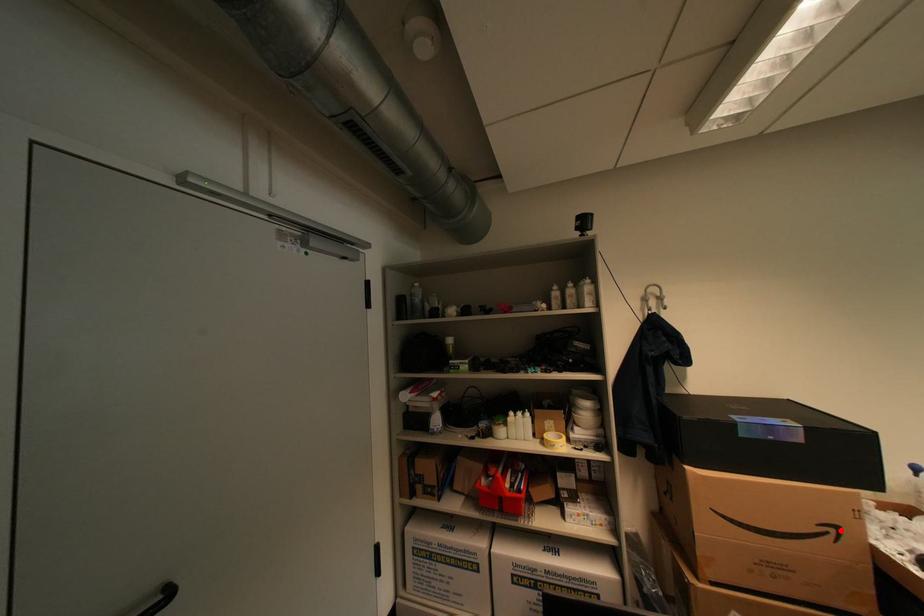
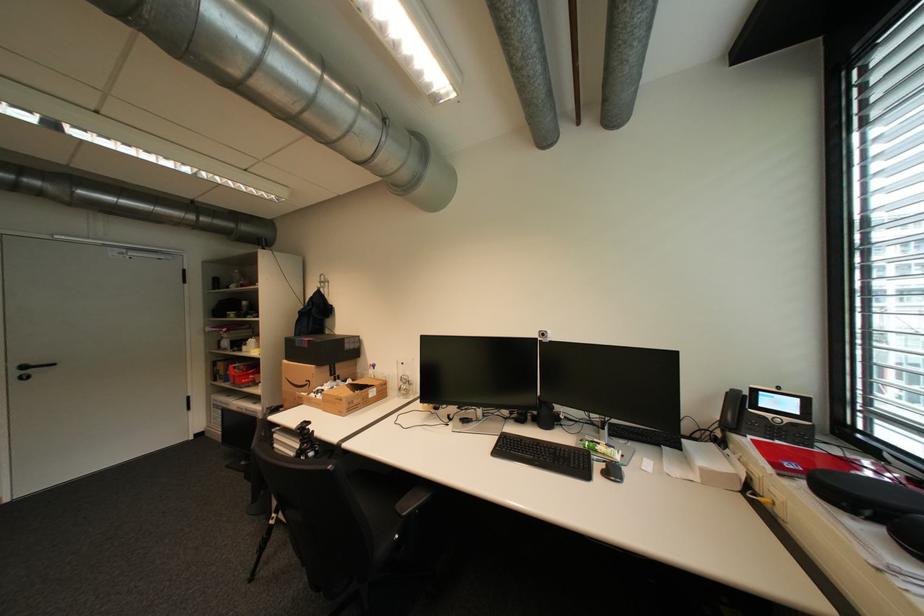
Question: I am providing you with two images of the same scene from different viewpoints. In image1, a red point is highlighted. Considering the same 3D point in image2, which of the following is correct?

Choices:
 (A) It is closer
 (B) It is farther

Answer: (B)